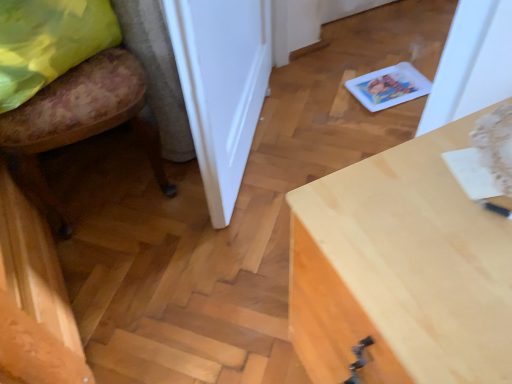
Where is `free space in front of floral fabric chair at lower left`? The image size is (512, 384). free space in front of floral fabric chair at lower left is located at coordinates (136, 274).